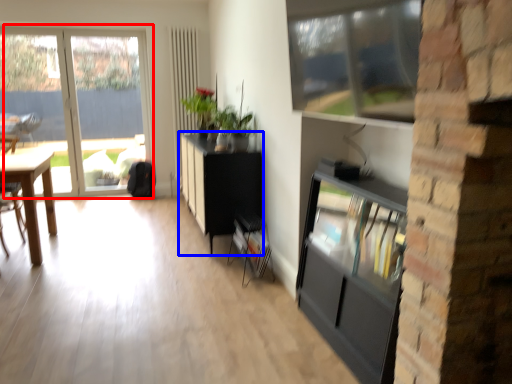
Question: Which point is closer to the camera, window (highlighted by a red box) or cabinetry (highlighted by a blue box)?

Choices:
 (A) window
 (B) cabinetry

Answer: (B)